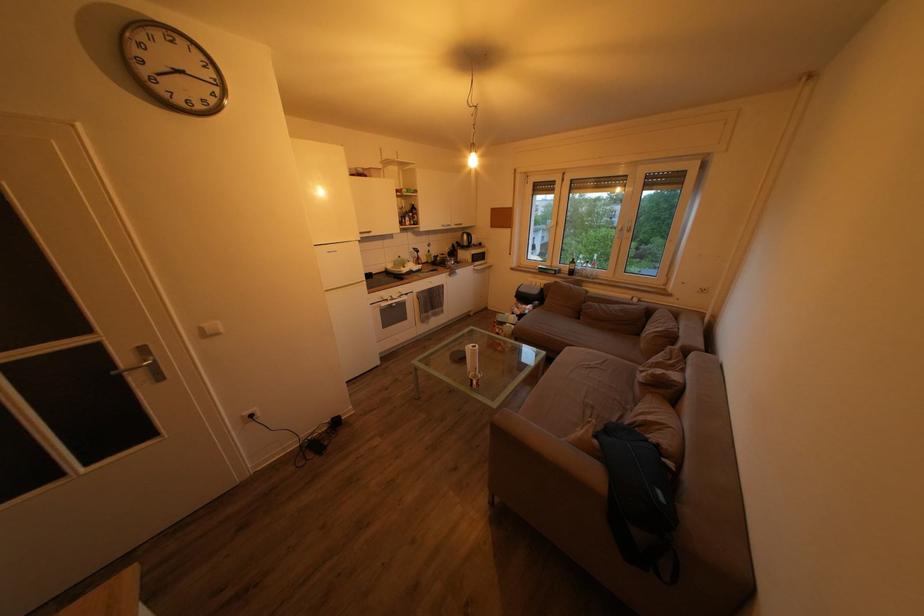
Where is `oven door handle`? The height and width of the screenshot is (616, 924). oven door handle is located at coordinates (390, 301).